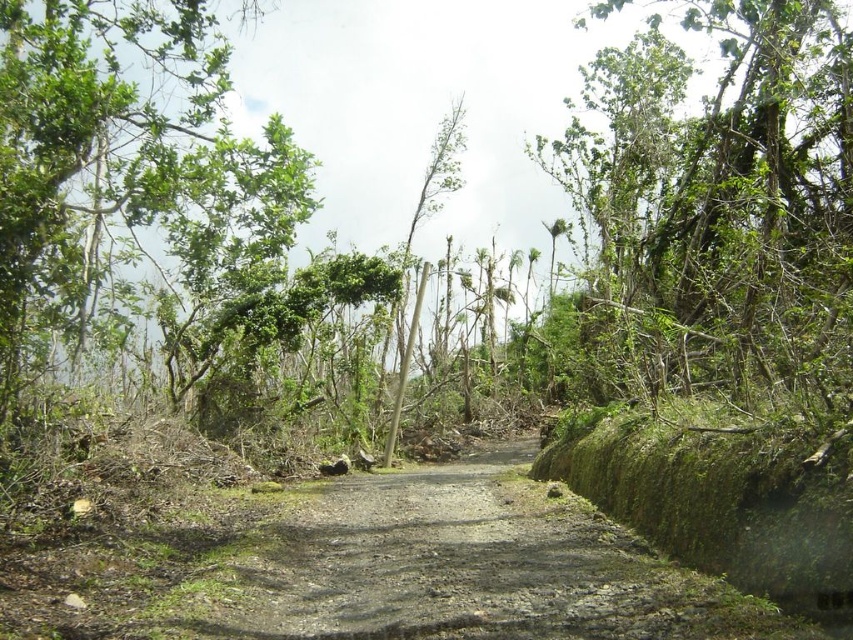
Question: Is the position of green leafy tree at upper right more distant than that of green leafy tree at upper left?

Choices:
 (A) no
 (B) yes

Answer: (A)

Question: From the image, what is the correct spatial relationship of green leafy tree at upper right in relation to green leafy tree at upper left?

Choices:
 (A) below
 (B) above

Answer: (B)

Question: Does green leafy tree at upper right come behind green leafy tree at upper left?

Choices:
 (A) no
 (B) yes

Answer: (A)

Question: Which object is farther from the camera taking this photo?

Choices:
 (A) green leafy tree at upper right
 (B) green leafy tree at upper left

Answer: (B)